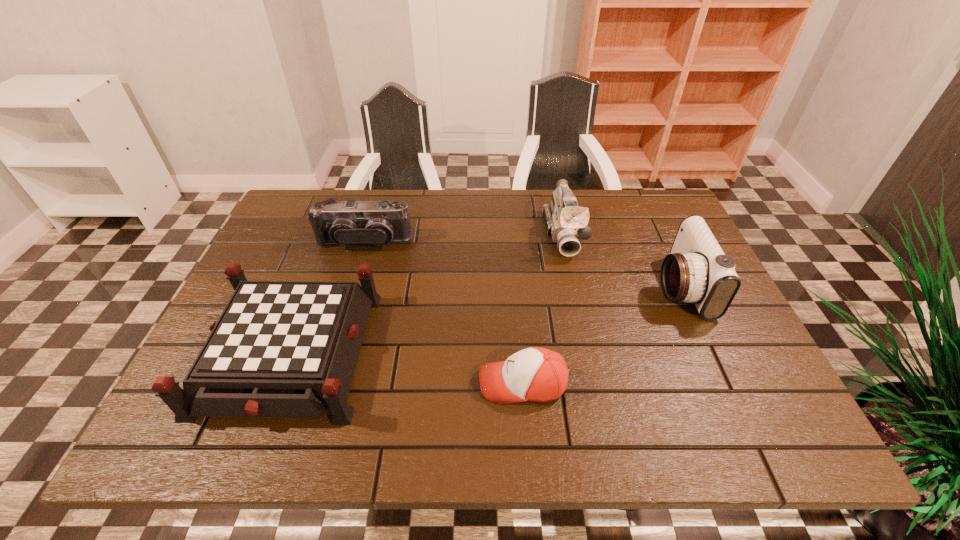
Find the location of a particular element. Image resolution: width=960 pixels, height=540 pixels. the second camcorder from right to left is located at coordinates (566, 222).

Locate an element on the screen. the rightmost object is located at coordinates (697, 271).

The height and width of the screenshot is (540, 960). Find the location of `the shortest camcorder`. the shortest camcorder is located at coordinates (349, 222).

The height and width of the screenshot is (540, 960). Find the location of `checkerboard`. checkerboard is located at coordinates pyautogui.click(x=280, y=348).

You are a GUI agent. You are given a task and a screenshot of the screen. Output one action in this format:
    pyautogui.click(x=<x>, y=<y>)
    Task: Click on the shortest object
    This screenshot has width=960, height=540.
    Given the screenshot: What is the action you would take?
    pyautogui.click(x=535, y=374)

This screenshot has width=960, height=540. Identify the location of the third object from right to left. (535, 374).

The image size is (960, 540). Identify the location of vacant space situated on the front-facing side of the second camcorder from left to right. (574, 282).

Where is `free space located 0.390m on the surface of the rightmost camcorder`? free space located 0.390m on the surface of the rightmost camcorder is located at coordinates (503, 286).

This screenshot has width=960, height=540. I want to click on vacant point located 0.080m on the surface of the rightmost camcorder, so click(x=625, y=286).

Image resolution: width=960 pixels, height=540 pixels. I want to click on free point located 0.190m on the surface of the rightmost camcorder, so click(582, 286).